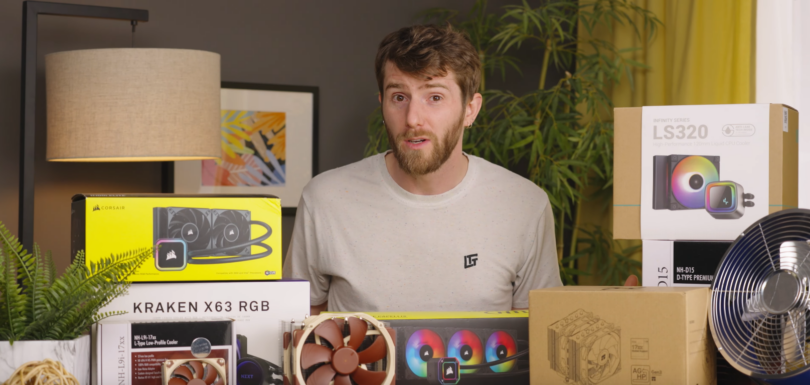
Locate an element on the screen. This screenshot has width=810, height=385. brown wall is located at coordinates (322, 54).